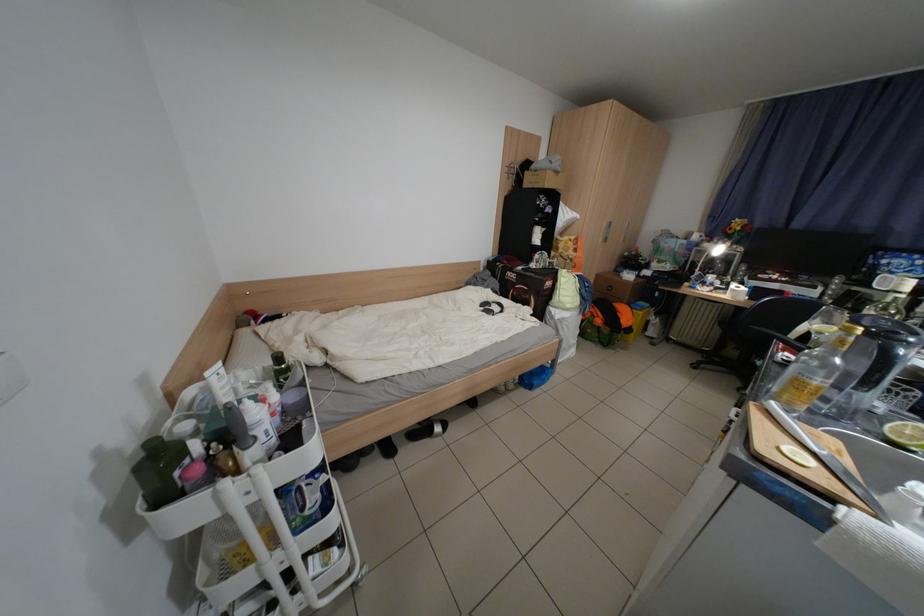
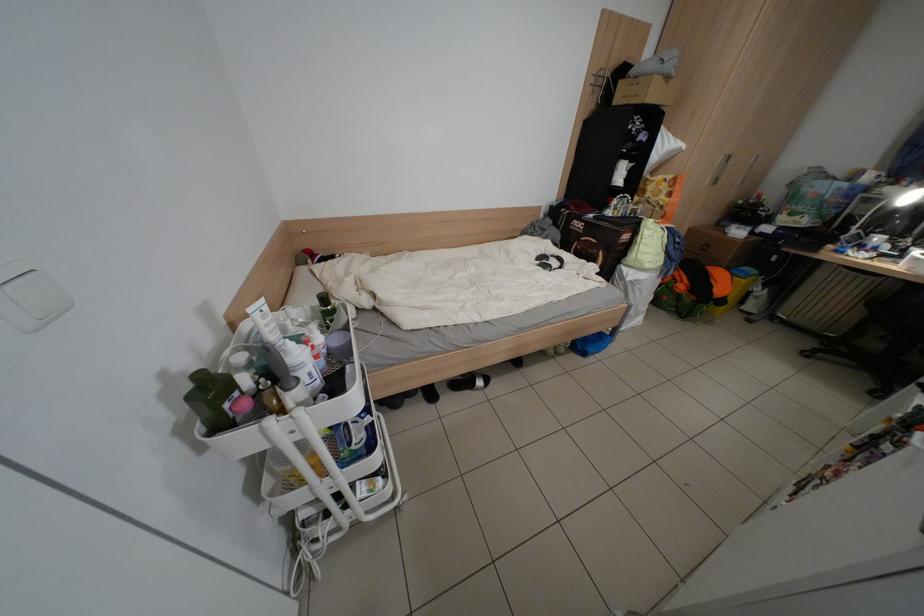
Locate, in the second image, the point that corresponds to (538,174) in the first image.

(631, 83)